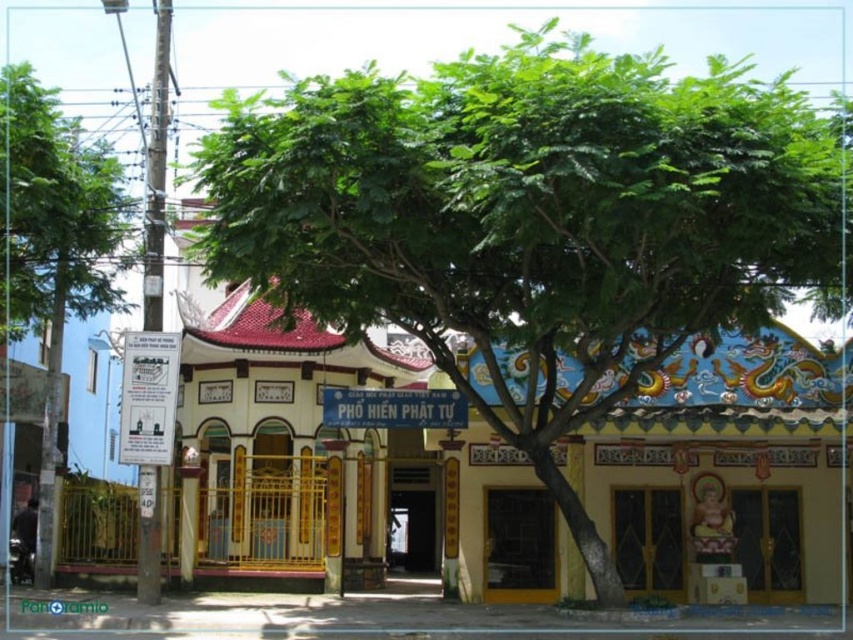
Question: Is green leafy tree at center wider than green leafy tree at left?

Choices:
 (A) yes
 (B) no

Answer: (A)

Question: Is green leafy tree at center positioned behind green leafy tree at left?

Choices:
 (A) yes
 (B) no

Answer: (B)

Question: Does green leafy tree at center appear on the left side of green leafy tree at left?

Choices:
 (A) yes
 (B) no

Answer: (B)